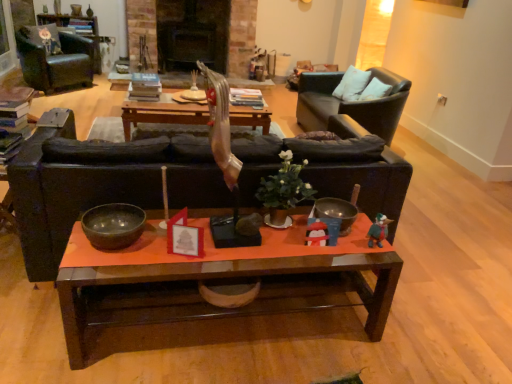
The height and width of the screenshot is (384, 512). What are the coordinates of `vacant space underneath green matte plant at center (from a real-world perspective)` in the screenshot? It's located at (281, 230).